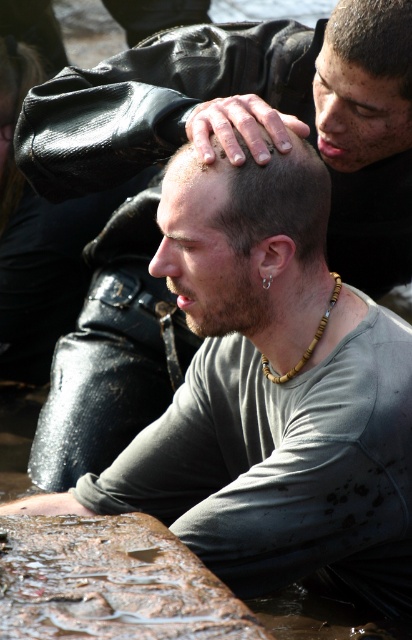
Does shiny black hair at center have a larger size compared to dark brown hair at upper center?

Yes, shiny black hair at center is bigger than dark brown hair at upper center.

Does shiny black hair at center have a lesser height compared to dark brown hair at upper center?

In fact, shiny black hair at center may be taller than dark brown hair at upper center.

Locate an element on the screen. shiny black hair at center is located at coordinates (233, 262).

This screenshot has width=412, height=640. In order to click on shiny black hair at center in this screenshot , I will do `click(233, 262)`.